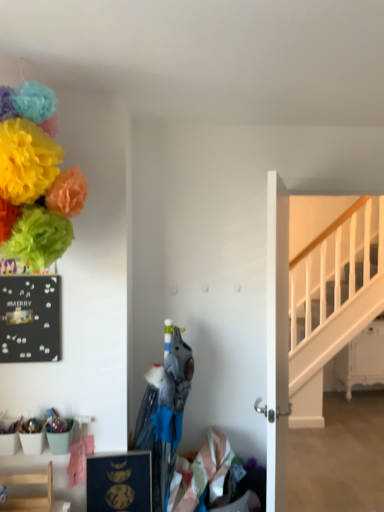
Question: Can you confirm if blue matte picture frame at lower center is positioned to the left of white glossy door at center?

Choices:
 (A) yes
 (B) no

Answer: (A)

Question: Is blue matte picture frame at lower center outside white glossy door at center?

Choices:
 (A) yes
 (B) no

Answer: (A)

Question: Is blue matte picture frame at lower center far from white glossy door at center?

Choices:
 (A) no
 (B) yes

Answer: (A)

Question: Is blue matte picture frame at lower center touching white glossy door at center?

Choices:
 (A) yes
 (B) no

Answer: (B)

Question: Does blue matte picture frame at lower center have a smaller size compared to white glossy door at center?

Choices:
 (A) yes
 (B) no

Answer: (A)

Question: Considering the positions of blue matte picture frame at lower center and matte paper flowers at upper left in the image, is blue matte picture frame at lower center bigger or smaller than matte paper flowers at upper left?

Choices:
 (A) big
 (B) small

Answer: (B)

Question: Is blue matte picture frame at lower center to the left or to the right of matte paper flowers at upper left in the image?

Choices:
 (A) left
 (B) right

Answer: (B)

Question: Considering their positions, is blue matte picture frame at lower center located in front of or behind matte paper flowers at upper left?

Choices:
 (A) behind
 (B) front

Answer: (A)

Question: Is point (119, 489) positioned closer to the camera than point (51, 175)?

Choices:
 (A) farther
 (B) closer

Answer: (A)

Question: Looking at the image, does white wooden stairs at right seem bigger or smaller compared to matte paper flowers at upper left?

Choices:
 (A) big
 (B) small

Answer: (A)

Question: Choose the correct answer: Is white wooden stairs at right inside matte paper flowers at upper left or outside it?

Choices:
 (A) outside
 (B) inside

Answer: (A)

Question: Is white wooden stairs at right taller or shorter than matte paper flowers at upper left?

Choices:
 (A) short
 (B) tall

Answer: (B)

Question: Considering the relative positions of white wooden stairs at right and matte paper flowers at upper left in the image provided, is white wooden stairs at right to the left or to the right of matte paper flowers at upper left?

Choices:
 (A) left
 (B) right

Answer: (B)

Question: In the image, is light wood chair at lower left positioned in front of or behind white glossy door at center?

Choices:
 (A) front
 (B) behind

Answer: (B)

Question: In terms of width, does light wood chair at lower left look wider or thinner when compared to white glossy door at center?

Choices:
 (A) thin
 (B) wide

Answer: (B)